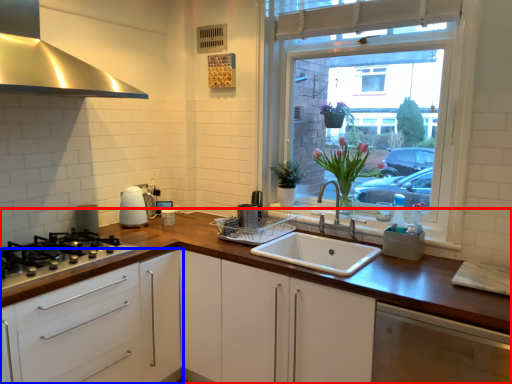
Question: Among these objects, which one is farthest to the camera, countertop (highlighted by a red box) or cabinetry (highlighted by a blue box)?

Choices:
 (A) countertop
 (B) cabinetry

Answer: (A)